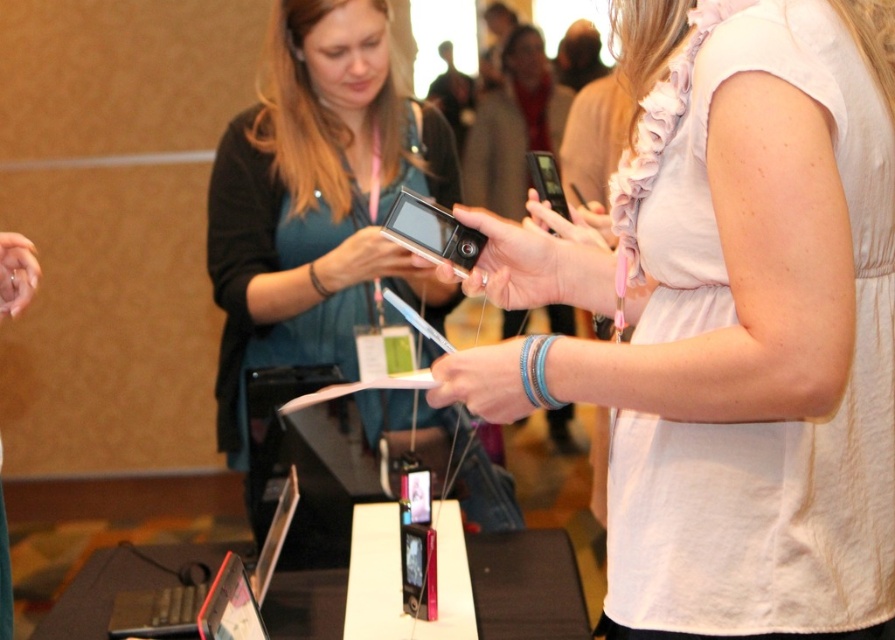
You are a photographer standing at the back of the event venue. You want to take a clear photo of the white matte shirt at center without any obstructions. Considering your current distance, can you adjust your camera settings to capture it sharply?

The white matte shirt at center and viewer are 36.76 inches apart from each other. Since the distance is relatively close, adjusting the camera focus to the white matte shirt at center should allow for a sharp capture without obstructions.

You are at the tech event and want to locate the white matte shirt at center. What are the coordinates where you can find it?

The white matte shirt at center can be found at coordinates point (738,330).

You are at a tech event and want to take a photo of the white matte shirt at center and the matte black camera at center. Which object is closer to the camera lens?

The white matte shirt at center is positioned under the matte black camera at center, so the matte black camera at center is closer to the camera lens.